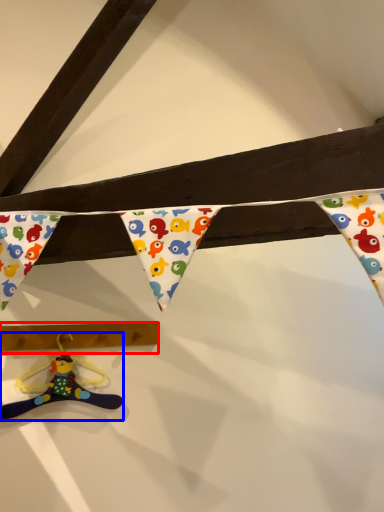
Question: Which point is further to the camera, plank (highlighted by a red box) or toy (highlighted by a blue box)?

Choices:
 (A) plank
 (B) toy

Answer: (A)